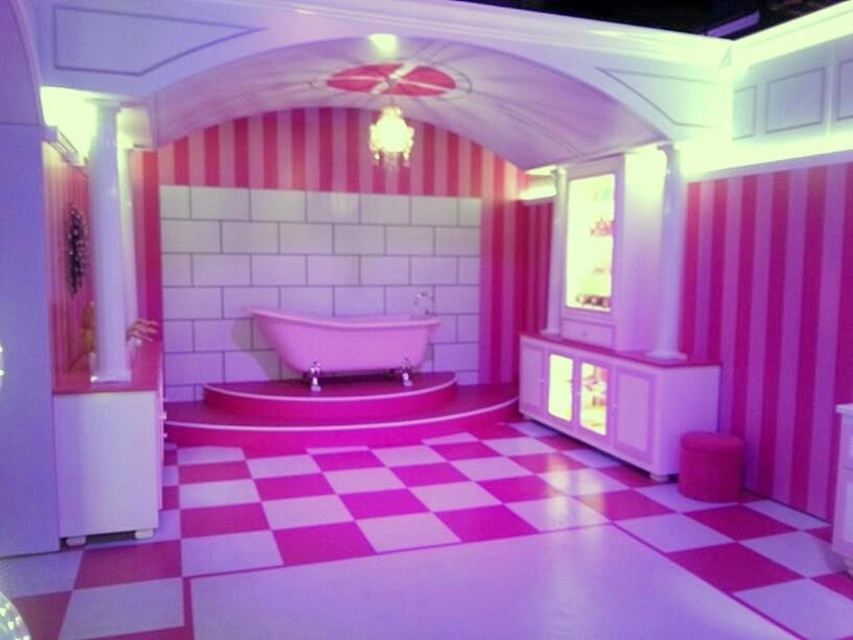
The image size is (853, 640). I want to click on white glossy column at left, so click(x=107, y=248).

Is point (113, 288) positioned after point (666, 298)?

No.

Where is `white glossy column at left`? The image size is (853, 640). white glossy column at left is located at coordinates (107, 248).

Is pink glossy bathtub at center bigger than white glossy pillar at upper center?

Yes, pink glossy bathtub at center is bigger than white glossy pillar at upper center.

Can you confirm if pink glossy bathtub at center is positioned above white glossy pillar at upper center?

Actually, pink glossy bathtub at center is below white glossy pillar at upper center.

Is point (392, 364) closer to camera compared to point (671, 320)?

No, it is behind (671, 320).

Where is `pink glossy bathtub at center`? The height and width of the screenshot is (640, 853). pink glossy bathtub at center is located at coordinates (346, 342).

Is pink glossy bathtub at center behind white glossy column at left?

Yes, pink glossy bathtub at center is further from the viewer.

Is pink glossy bathtub at center wider than white glossy column at left?

Yes, pink glossy bathtub at center is wider than white glossy column at left.

Describe the element at coordinates (346, 342) in the screenshot. I see `pink glossy bathtub at center` at that location.

Identify the location of pink glossy bathtub at center. (x=346, y=342).